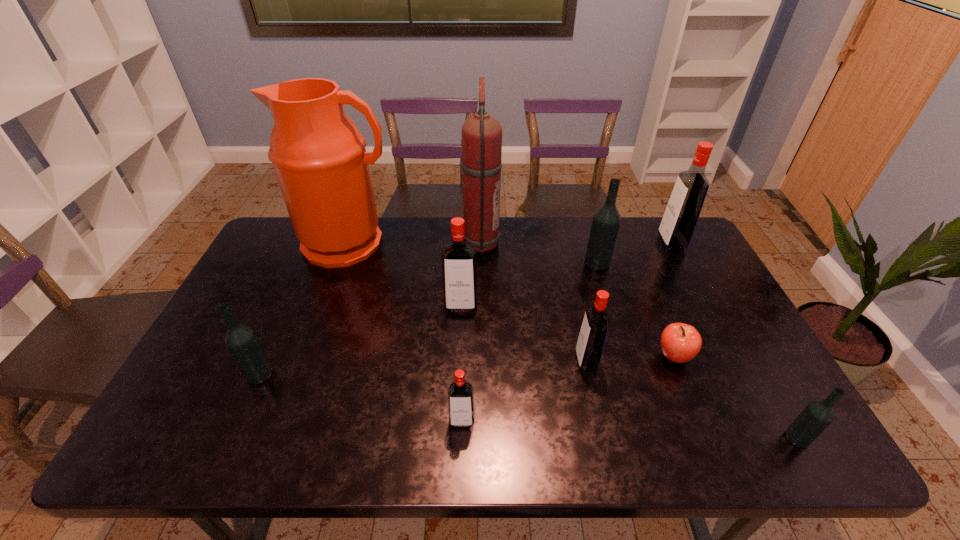
Locate an element on the screen. the fourth vodka from right to left is located at coordinates (589, 349).

The width and height of the screenshot is (960, 540). Identify the location of the fifth object from right to left. (x=589, y=349).

Locate an element on the screen. This screenshot has height=540, width=960. the smallest red vodka is located at coordinates (x=461, y=411).

The width and height of the screenshot is (960, 540). In order to click on the nearest black vodka in this screenshot , I will do `click(818, 415)`.

Locate an element on the screen. The width and height of the screenshot is (960, 540). the smallest black vodka is located at coordinates (818, 415).

At what (x,y) coordinates should I click in order to perform the action: click on pink apple. Please return your answer as a coordinate pair (x, y). The height and width of the screenshot is (540, 960). Looking at the image, I should click on (680, 342).

This screenshot has width=960, height=540. Find the location of `the third object from right to left`. the third object from right to left is located at coordinates (680, 342).

I want to click on free spot located from the spout of the orange water jug, so click(x=316, y=334).

Identify the location of free point located on the side of the red fire extinguisher with the label and nozzle. This screenshot has height=540, width=960. (584, 244).

Find the location of a particular element. This screenshot has width=960, height=540. blank space located 0.120m on the front and back of the rightmost red vodka is located at coordinates (625, 243).